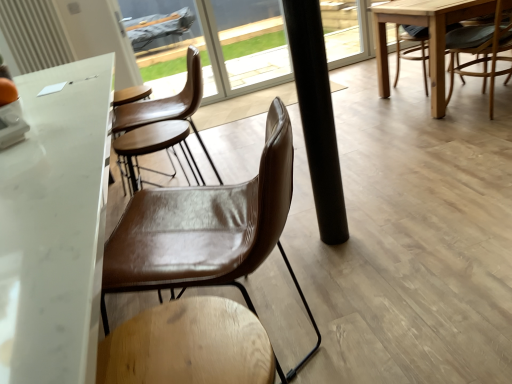
Find the location of `free space to the back side of black matte pole at center`. free space to the back side of black matte pole at center is located at coordinates (314, 215).